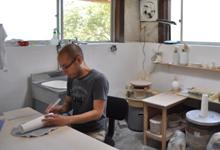
Identify the location of walls. Image resolution: width=220 pixels, height=150 pixels. (96, 58), (208, 57).